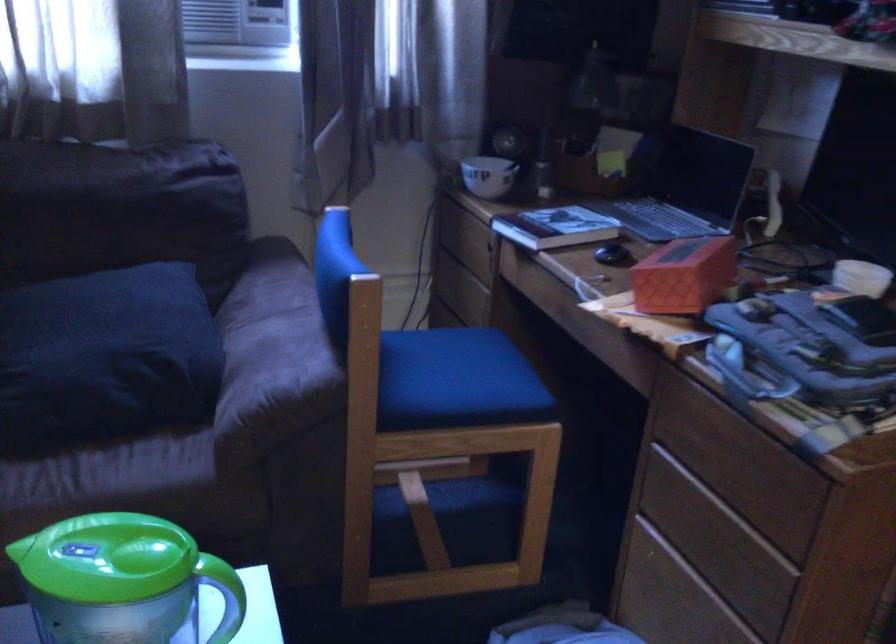
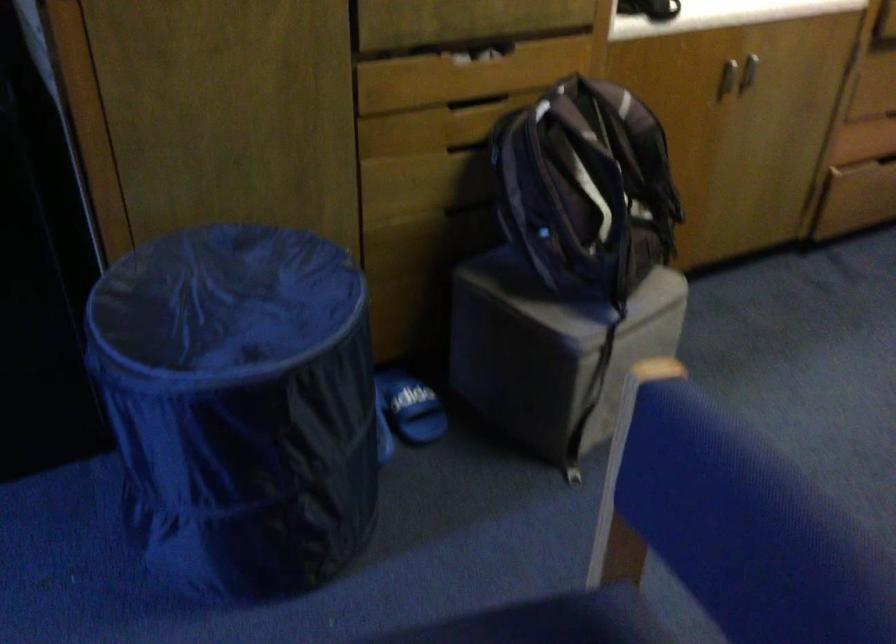
First-person continuous shooting, in which direction is the camera rotating?

The camera's rotation is toward right-down.